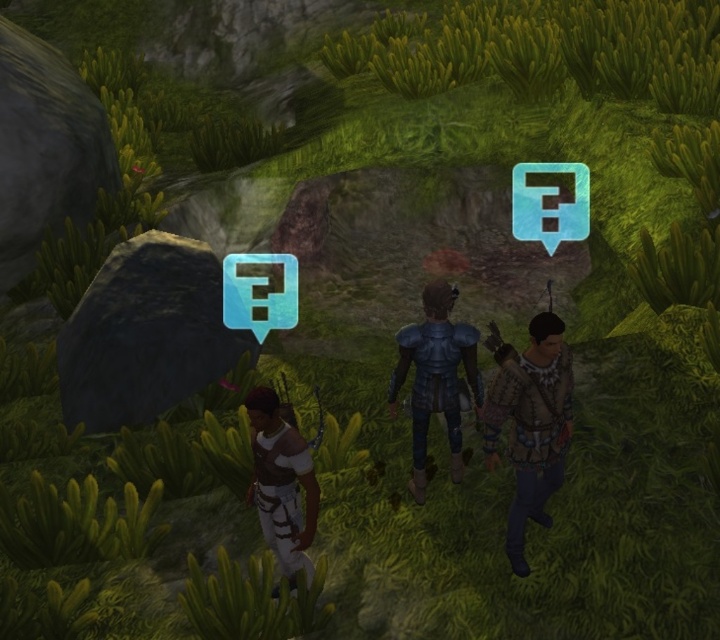
Does point (482, 406) come in front of point (400, 332)?

That is True.

Find the location of a particular element. Image resolution: width=720 pixels, height=640 pixels. brown leather vest at right is located at coordinates (531, 422).

Where is `brown leather vest at right`? The width and height of the screenshot is (720, 640). brown leather vest at right is located at coordinates (531, 422).

Is metallic blue armor at center below white leather pants at lower center?

Incorrect, metallic blue armor at center is not positioned below white leather pants at lower center.

What do you see at coordinates (436, 378) in the screenshot? I see `metallic blue armor at center` at bounding box center [436, 378].

Identify the location of metallic blue armor at center. (436, 378).

Which of these two, brown leather vest at right or white leather pants at lower center, stands taller?

Standing taller between the two is brown leather vest at right.

Does point (546, 365) come closer to viewer compared to point (258, 436)?

Yes, it is in front of point (258, 436).

You are a GUI agent. You are given a task and a screenshot of the screen. Output one action in this format:
    pyautogui.click(x=<x>, y=<y>)
    Task: Click on the brown leather vest at right
    This screenshot has height=640, width=720.
    Given the screenshot: What is the action you would take?
    pyautogui.click(x=531, y=422)